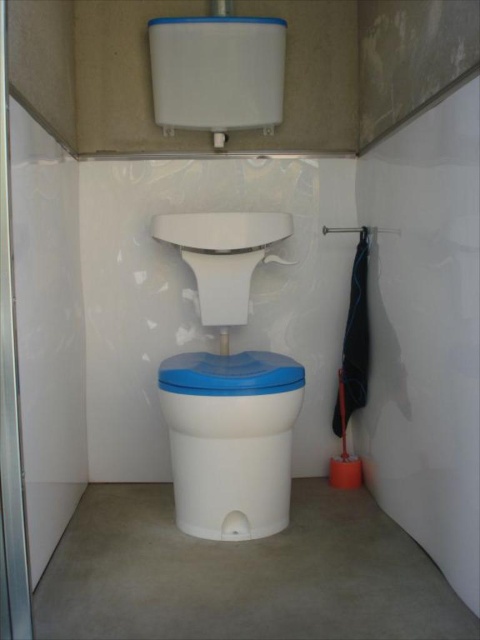
Is white plastic toilet bowl at center above transparent glass screen door at left?

No, white plastic toilet bowl at center is not above transparent glass screen door at left.

Is white plastic toilet bowl at center thinner than transparent glass screen door at left?

Incorrect, white plastic toilet bowl at center's width is not less than transparent glass screen door at left's.

Is point (263, 394) closer to camera compared to point (2, 490)?

No, it is behind (2, 490).

You are a GUI agent. You are given a task and a screenshot of the screen. Output one action in this format:
    pyautogui.click(x=<x>, y=<y>)
    Task: Click on the white plastic toilet bowl at center
    The image size is (480, 640).
    Given the screenshot: What is the action you would take?
    [230, 440]